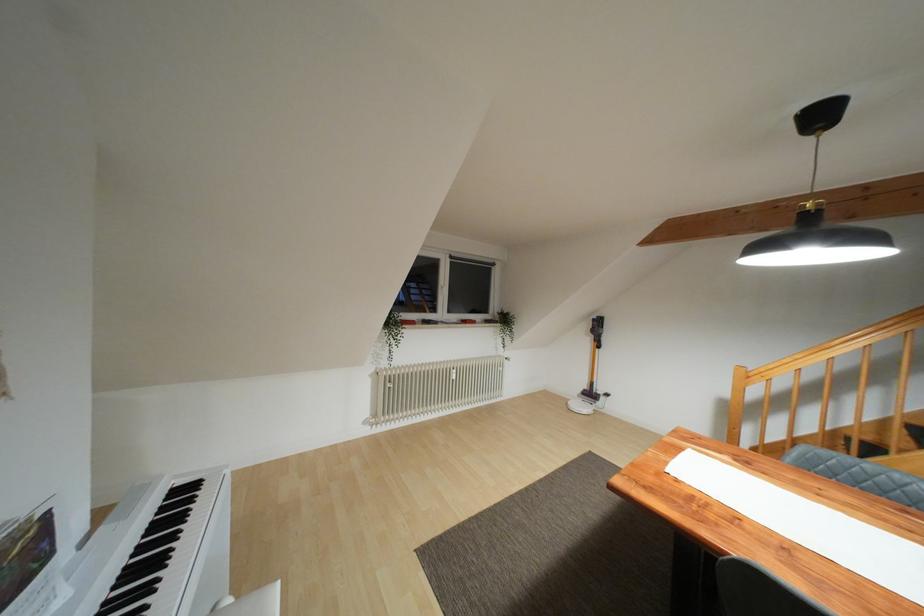
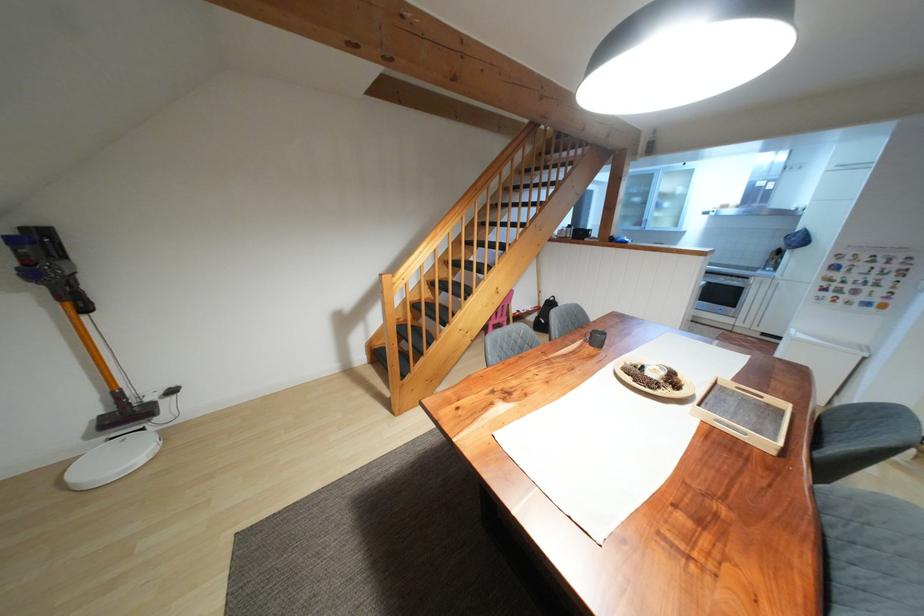
Where in the second image is the point corresponding to (569,402) from the first image?

(74, 474)